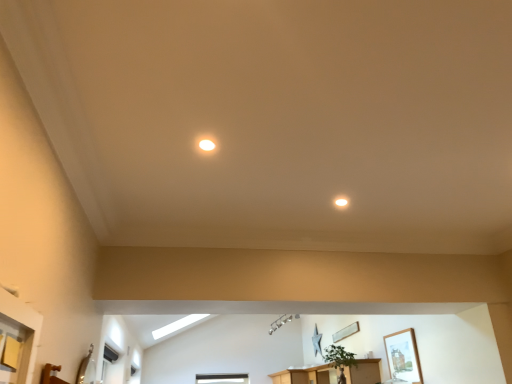
Question: In terms of height, does wooden framed picture at upper right, which ranks as the first picture frame in right-to-left order, look taller or shorter compared to matte white light fixture at upper center, the 1th lighting in the right-to-left sequence?

Choices:
 (A) short
 (B) tall

Answer: (B)

Question: From the image's perspective, is wooden framed picture at upper right, which ranks as the first picture frame in right-to-left order, positioned above or below matte white light fixture at upper center, the 1th lighting in the right-to-left sequence?

Choices:
 (A) above
 (B) below

Answer: (B)

Question: Which object is the closest to the wooden picture frame at center, placed as the 1th picture frame when sorted from left to right?

Choices:
 (A) wooden cabinet at lower center
 (B) green matte plant at center
 (C) wooden framed picture at upper right, the 2th picture frame in the back-to-front sequence
 (D) matte white light fixture at upper center, the 1th lighting in the right-to-left sequence
 (E) matte white light fixture at upper center, the second lighting in the back-to-front sequence

Answer: (B)

Question: Which of these objects is positioned closest to the wooden picture frame at center, which is counted as the 2th picture frame, starting from the front?

Choices:
 (A) matte white light fixture at upper center, which is counted as the 1th lighting, starting from the bottom
 (B) matte white light fixture at upper center, which is the 1th lighting from front to back
 (C) wooden cabinet at lower center
 (D) green matte plant at center
 (E) wooden framed picture at upper right, which ranks as the first picture frame in right-to-left order

Answer: (D)